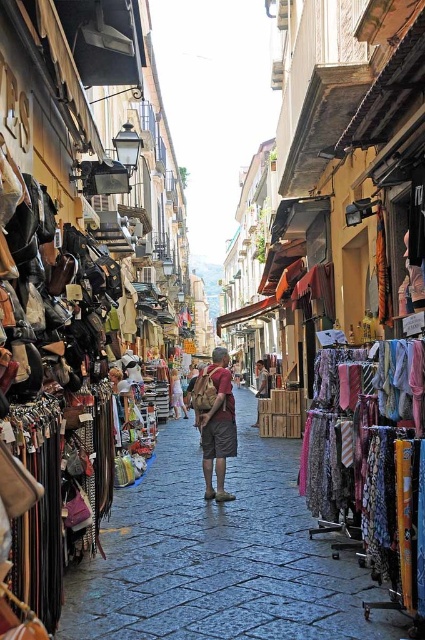
Question: Which object is positioned farthest from the denim shorts at center?

Choices:
 (A) light brown leather backpack at center
 (B) brown leather backpack at center
 (C) dark stone pavement at center

Answer: (C)

Question: Which point is farther to the camera?

Choices:
 (A) light brown leather backpack at center
 (B) denim shorts at center
 (C) dark stone pavement at center

Answer: (B)

Question: In this image, where is dark stone pavement at center located relative to light brown leather backpack at center?

Choices:
 (A) above
 (B) below

Answer: (B)

Question: Which point is farther from the camera taking this photo?

Choices:
 (A) (265, 392)
 (B) (221, 477)
 (C) (178, 381)
 (D) (397, 625)

Answer: (C)

Question: Is denim shorts at center below light brown leather backpack at center?

Choices:
 (A) no
 (B) yes

Answer: (B)

Question: Does dark stone pavement at center appear under brown leather backpack at center?

Choices:
 (A) no
 (B) yes

Answer: (B)